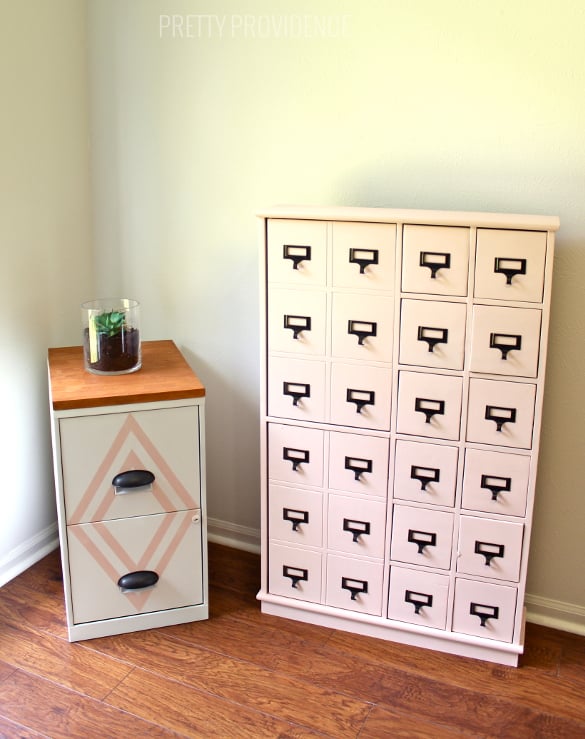
The image size is (585, 739). In order to click on white wall in this screenshot , I will do `click(70, 270)`, `click(216, 200)`.